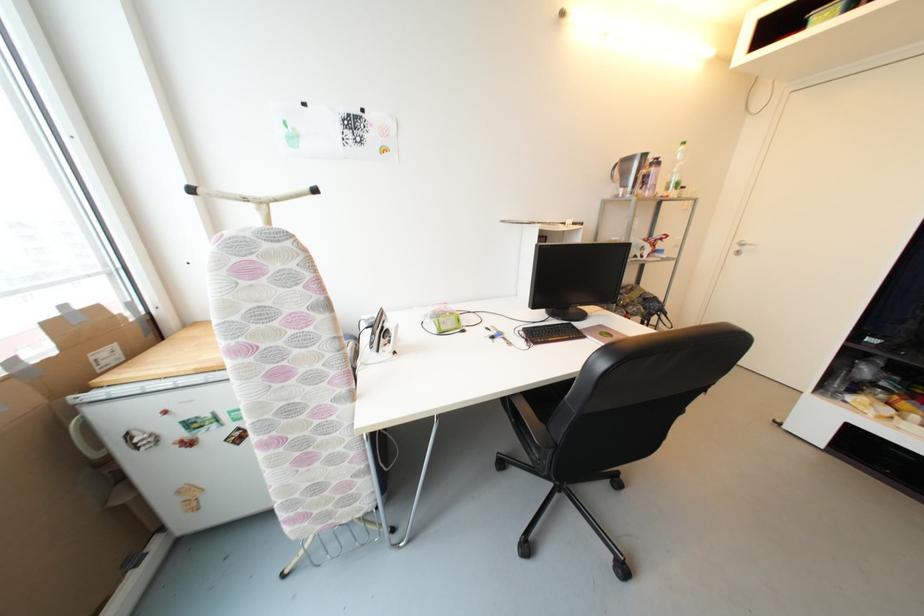
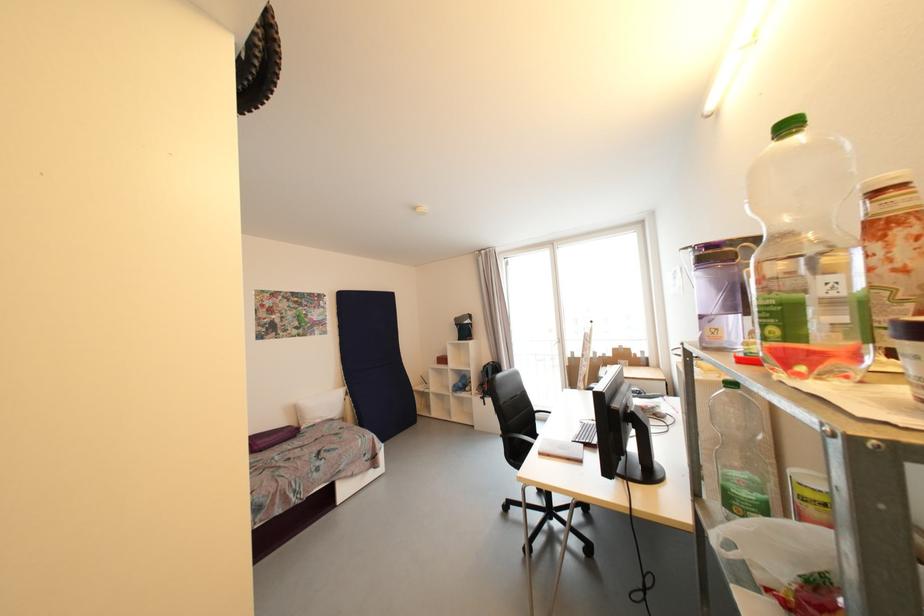
Question: I am providing you with two images of the same scene from different viewpoints. After the viewpoint changes to image2, which objects are now occluded?

Choices:
 (A) small green purse
 (B) empty glass jar
 (C) clear plastic bottle
 (D) set of keys

Answer: (D)